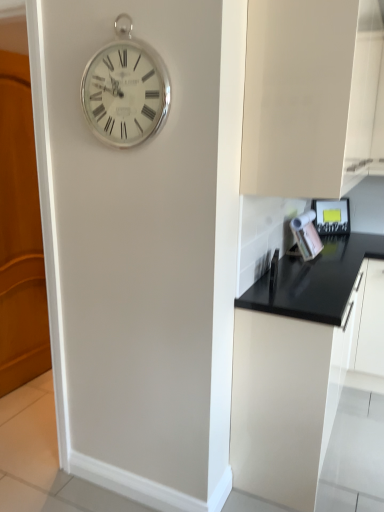
Question: Can you confirm if metallic silver toaster at right is smaller than silver metallic clock at upper center?

Choices:
 (A) yes
 (B) no

Answer: (B)

Question: Is metallic silver toaster at right not near silver metallic clock at upper center?

Choices:
 (A) yes
 (B) no

Answer: (A)

Question: Is metallic silver toaster at right bigger than silver metallic clock at upper center?

Choices:
 (A) yes
 (B) no

Answer: (A)

Question: Is the surface of metallic silver toaster at right in direct contact with silver metallic clock at upper center?

Choices:
 (A) no
 (B) yes

Answer: (A)

Question: Does metallic silver toaster at right have a greater height compared to silver metallic clock at upper center?

Choices:
 (A) no
 (B) yes

Answer: (A)

Question: Is silver metallic clock at upper center located within metallic silver toaster at right?

Choices:
 (A) yes
 (B) no

Answer: (B)

Question: Can metallic silver toaster at right be found inside wooden at left?

Choices:
 (A) no
 (B) yes

Answer: (A)

Question: Can you confirm if wooden at left is thinner than metallic silver toaster at right?

Choices:
 (A) yes
 (B) no

Answer: (B)

Question: From the image's perspective, does wooden at left appear higher than metallic silver toaster at right?

Choices:
 (A) no
 (B) yes

Answer: (A)

Question: From a real-world perspective, is wooden at left physically below metallic silver toaster at right?

Choices:
 (A) yes
 (B) no

Answer: (A)

Question: Is wooden at left to the right of metallic silver toaster at right from the viewer's perspective?

Choices:
 (A) yes
 (B) no

Answer: (B)

Question: Is wooden at left further to the viewer compared to metallic silver toaster at right?

Choices:
 (A) yes
 (B) no

Answer: (B)

Question: From the image's perspective, is black matte cabinet at lower right, placed as the first cabinetry when sorted from bottom to top, over metallic silver toaster at right?

Choices:
 (A) no
 (B) yes

Answer: (A)